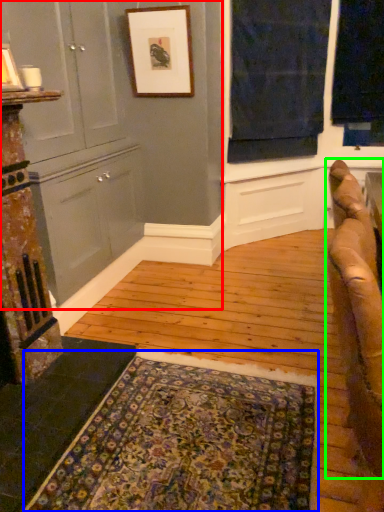
Question: Considering the real-world distances, which object is farthest from dresser (highlighted by a red box)? mat (highlighted by a blue box) or studio couch (highlighted by a green box)?

Choices:
 (A) mat
 (B) studio couch

Answer: (B)